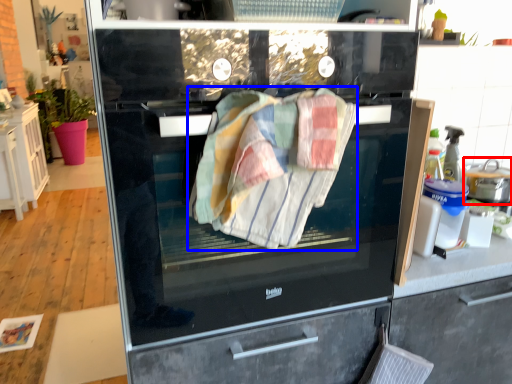
Question: Which object is closer to the camera taking this photo, kitchen appliance (highlighted by a red box) or bath towel (highlighted by a blue box)?

Choices:
 (A) kitchen appliance
 (B) bath towel

Answer: (B)